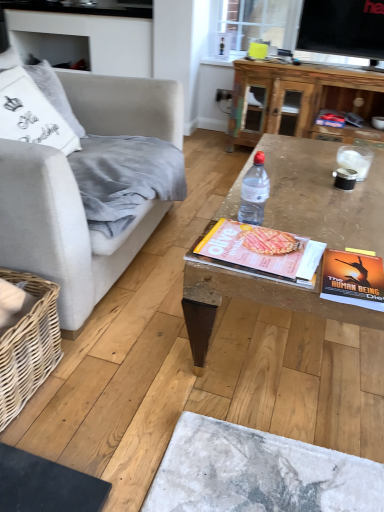
Find the location of a particular element. The height and width of the screenshot is (512, 384). vacant space in matte yellow magazine at center (from a real-world perspective) is located at coordinates (261, 251).